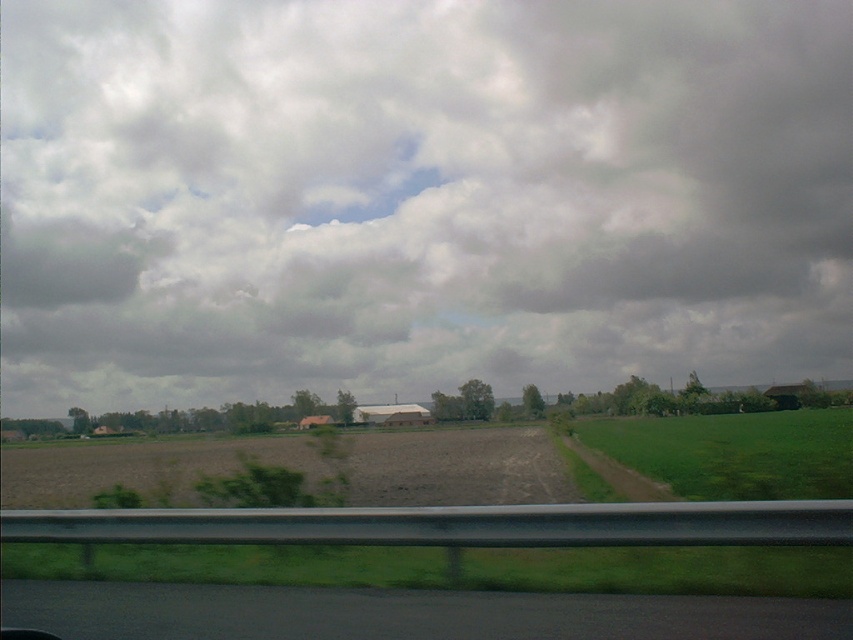
I want to click on cloudy sky at upper center, so click(x=419, y=196).

Between cloudy sky at upper center and green grassy field at right, which one is positioned lower?

green grassy field at right is below.

Between point (840, 259) and point (810, 490), which one is positioned behind?

The point (840, 259) is more distant.

This screenshot has width=853, height=640. What are the coordinates of `cloudy sky at upper center` in the screenshot? It's located at (419, 196).

Can you confirm if black asphalt road at lower left is positioned to the right of green grassy field at right?

Incorrect, black asphalt road at lower left is not on the right side of green grassy field at right.

Who is more distant from viewer, (432, 604) or (814, 472)?

Positioned behind is point (814, 472).

At what (x,y) coordinates should I click in order to perform the action: click on black asphalt road at lower left. Please return your answer as a coordinate pair (x, y). Looking at the image, I should click on (403, 612).

At what (x,y) coordinates should I click in order to perform the action: click on black asphalt road at lower left. Please return your answer as a coordinate pair (x, y). Looking at the image, I should click on (403, 612).

Who is lower down, cloudy sky at upper center or black asphalt road at lower left?

Positioned lower is black asphalt road at lower left.

Who is shorter, cloudy sky at upper center or black asphalt road at lower left?

black asphalt road at lower left is shorter.

Who is more distant from viewer, (143,3) or (451,612)?

The point (143,3) is more distant.

You are a GUI agent. You are given a task and a screenshot of the screen. Output one action in this format:
    pyautogui.click(x=<x>, y=<y>)
    Task: Click on the cloudy sky at upper center
    
    Given the screenshot: What is the action you would take?
    pyautogui.click(x=419, y=196)